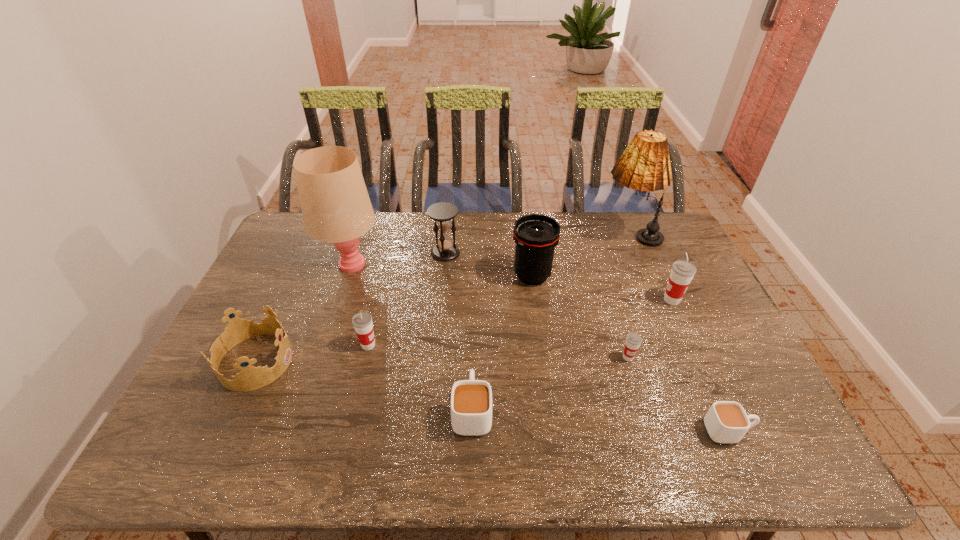
Where is `the third cup from left to right`? The image size is (960, 540). the third cup from left to right is located at coordinates (633, 340).

Locate an element on the screen. the second red cup from left to right is located at coordinates (633, 340).

The width and height of the screenshot is (960, 540). In order to click on the fifth object from left to right in this screenshot , I will do `click(471, 400)`.

The image size is (960, 540). I want to click on the second cup from left to right, so click(471, 400).

The width and height of the screenshot is (960, 540). What are the coordinates of `the shortest object` in the screenshot? It's located at (726, 421).

Where is `the right white cup`? the right white cup is located at coordinates click(x=726, y=421).

This screenshot has height=540, width=960. Find the location of `vacant region located on the front-facing side of the right lampshade`. vacant region located on the front-facing side of the right lampshade is located at coordinates (516, 235).

Identify the location of vacant point located on the front-facing side of the right lampshade. (493, 235).

You are a GUI agent. You are given a task and a screenshot of the screen. Output one action in this format:
    pyautogui.click(x=<x>, y=<y>)
    Task: Click on the vacant area situated 0.120m on the front-facing side of the right lampshade
    Image resolution: width=960 pixels, height=540 pixels.
    Given the screenshot: What is the action you would take?
    pyautogui.click(x=565, y=235)

Locate an element on the screen. Image resolution: width=960 pixels, height=540 pixels. free space located 0.100m on the front of the pink lampshade is located at coordinates (337, 309).